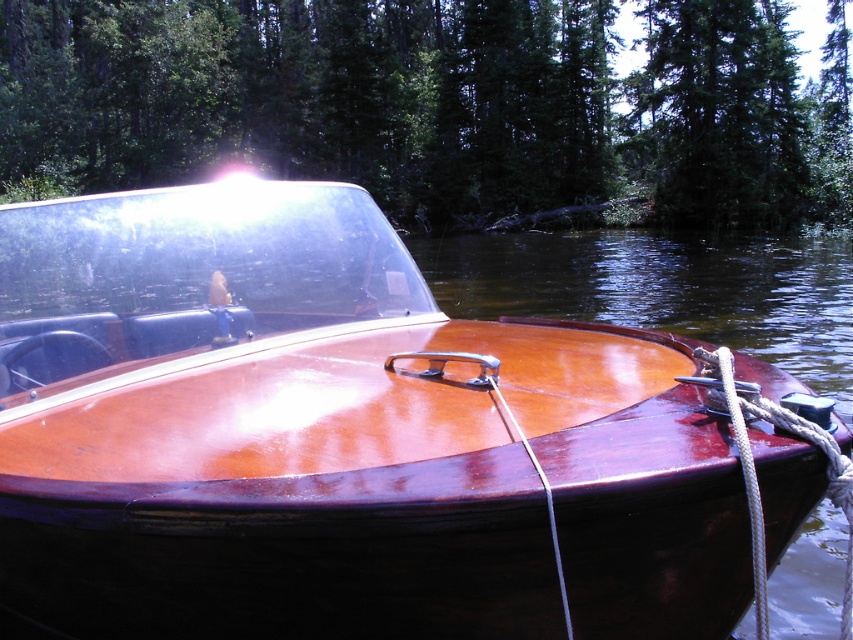
You are standing on the dock and want to take a photo of the glossy wood boat at center. If your camera requires a minimum distance of 5 feet to focus properly, will you be able to take a clear photo from your current position?

The glossy wood boat at center and camera are 4.69 feet apart, which is less than the required 5 feet. Therefore, you will not be able to take a clear photo from your current position.

You are a photographer planning to take a picture of the glossy wood boat at center. You want to position your camera at point (x=334, y=436). Is this point on the boat?

Yes, the point (x=334, y=436) is on the glossy wood boat at center according to the description.

You are an observer standing on the dock. You see the glossy wood boat at center and the green matte tree at upper center. Which object appears larger to you?

The green matte tree at upper center appears larger than the glossy wood boat at center.